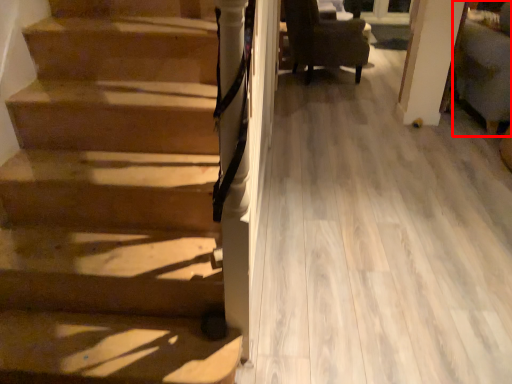
Question: From the image's perspective, considering the relative positions of armchair (annotated by the red box) and chair in the image provided, where is armchair (annotated by the red box) located with respect to the staircase?

Choices:
 (A) above
 (B) below

Answer: (B)